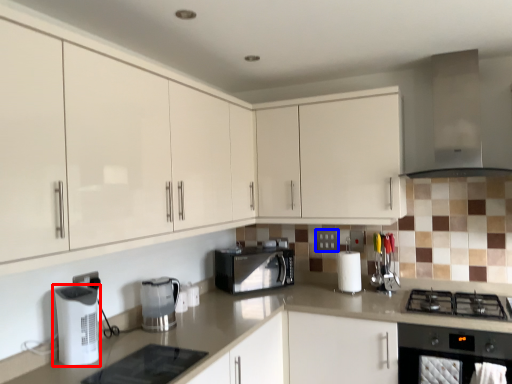
Question: Which of the following is the closest to the observer, kitchen appliance (highlighted by a red box) or electric outlet (highlighted by a blue box)?

Choices:
 (A) kitchen appliance
 (B) electric outlet

Answer: (A)